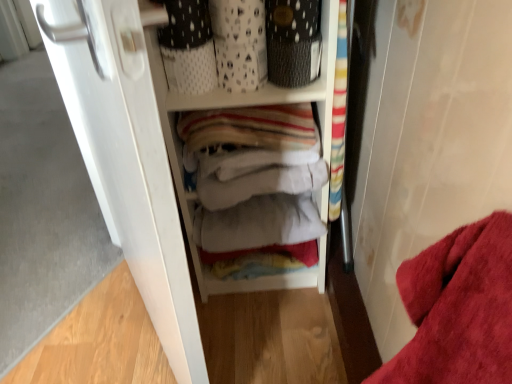
Question: Is white fabric at center positioned behind white matte door at left?

Choices:
 (A) yes
 (B) no

Answer: (A)

Question: Is white fabric at center closer to camera compared to white matte door at left?

Choices:
 (A) no
 (B) yes

Answer: (A)

Question: Is white fabric at center wider than white matte door at left?

Choices:
 (A) yes
 (B) no

Answer: (A)

Question: From a real-world perspective, is white fabric at center under white matte door at left?

Choices:
 (A) no
 (B) yes

Answer: (B)

Question: Is white matte door at left surrounded by white fabric at center?

Choices:
 (A) yes
 (B) no

Answer: (B)

Question: From the image's perspective, is textured black basket at upper center above or below white fabric at center?

Choices:
 (A) above
 (B) below

Answer: (A)

Question: Is textured black basket at upper center taller or shorter than white fabric at center?

Choices:
 (A) tall
 (B) short

Answer: (B)

Question: Based on their positions, is textured black basket at upper center located to the left or right of white fabric at center?

Choices:
 (A) left
 (B) right

Answer: (B)

Question: In terms of size, does textured black basket at upper center appear bigger or smaller than white fabric at center?

Choices:
 (A) big
 (B) small

Answer: (B)

Question: Is white matte door at left spatially inside textured black basket at upper center, or outside of it?

Choices:
 (A) inside
 (B) outside

Answer: (B)

Question: Looking at their shapes, would you say white matte door at left is wider or thinner than textured black basket at upper center?

Choices:
 (A) wide
 (B) thin

Answer: (A)

Question: Considering the positions of white matte door at left and textured black basket at upper center in the image, is white matte door at left bigger or smaller than textured black basket at upper center?

Choices:
 (A) big
 (B) small

Answer: (A)

Question: Considering the relative positions of white matte door at left and textured black basket at upper center in the image provided, is white matte door at left to the left or to the right of textured black basket at upper center?

Choices:
 (A) left
 (B) right

Answer: (A)

Question: Considering the positions of point (182, 251) and point (209, 96), is point (182, 251) closer or farther from the camera than point (209, 96)?

Choices:
 (A) farther
 (B) closer

Answer: (B)

Question: Is white matte door at left bigger or smaller than white fabric at center?

Choices:
 (A) small
 (B) big

Answer: (B)